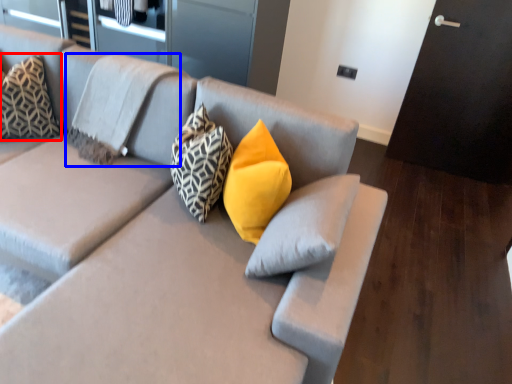
Question: Among these objects, which one is nearest to the camera, pillow (highlighted by a red box) or pillow (highlighted by a blue box)?

Choices:
 (A) pillow
 (B) pillow

Answer: (B)